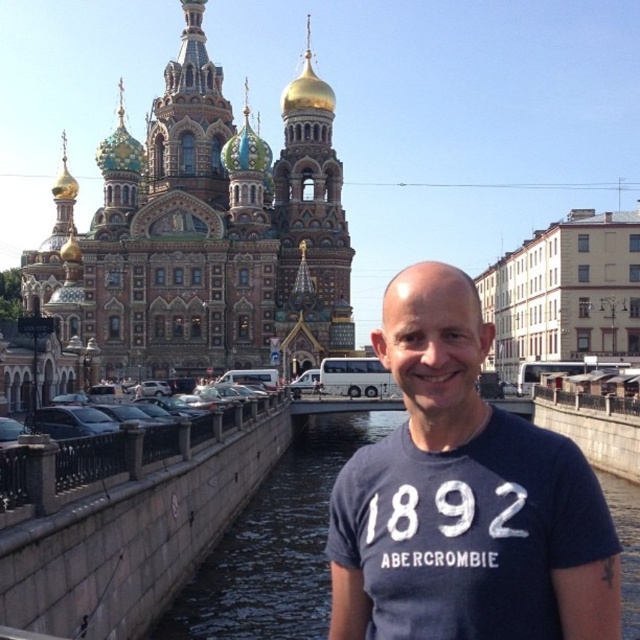
Question: Is golden domed church at upper left positioned behind dark gray concrete river at center?

Choices:
 (A) yes
 (B) no

Answer: (A)

Question: Can you confirm if golden domed church at upper left is wider than dark blue t-shirt at center?

Choices:
 (A) yes
 (B) no

Answer: (A)

Question: Which point is closer to the camera?

Choices:
 (A) dark gray concrete river at center
 (B) golden domed church at upper left
 (C) dark blue t-shirt at center

Answer: (C)

Question: Estimate the real-world distances between objects in this image. Which object is closer to the golden domed church at upper left?

Choices:
 (A) dark blue t-shirt at center
 (B) dark gray concrete river at center

Answer: (B)

Question: Considering the real-world distances, which object is farthest from the dark gray concrete river at center?

Choices:
 (A) golden domed church at upper left
 (B) dark blue t-shirt at center

Answer: (A)

Question: Does golden domed church at upper left appear on the right side of dark gray concrete river at center?

Choices:
 (A) no
 (B) yes

Answer: (A)